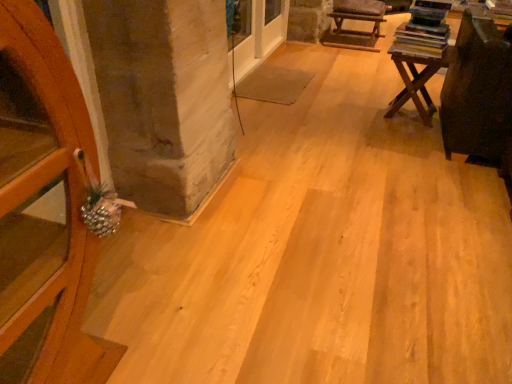
Find the location of `wooden table at right`. wooden table at right is located at coordinates (417, 75).

What is the approximate height of wooden table at right?

wooden table at right is 43.69 centimeters in height.

What do you see at coordinates (417, 75) in the screenshot? I see `wooden table at right` at bounding box center [417, 75].

This screenshot has width=512, height=384. Describe the element at coordinates (355, 19) in the screenshot. I see `brown leather armchair at upper right` at that location.

Measure the distance between brown leather armchair at upper right and camera.

brown leather armchair at upper right is 14.09 feet away from camera.

In order to face brown leather armchair at upper right, should I rotate leftwards or rightwards?

To face it directly, rotate right by 13.568 degrees.

In order to click on brown leather armchair at upper right in this screenshot , I will do `click(355, 19)`.

Find the location of `wooden table at right`. wooden table at right is located at coordinates (417, 75).

Is wooden table at right to the left of brown leather armchair at upper right from the viewer's perspective?

In fact, wooden table at right is to the right of brown leather armchair at upper right.

Which object is closer to the camera taking this photo, wooden table at right or brown leather armchair at upper right?

wooden table at right is in front.

Consider the image. Which point is more distant from viewer, (416,31) or (340,0)?

Point (340,0)

From the image's perspective, which object appears higher, wooden table at right or brown leather armchair at upper right?

brown leather armchair at upper right is shown above in the image.

In the scene shown: From a real-world perspective, is wooden table at right below brown leather armchair at upper right?

Actually, wooden table at right is physically above brown leather armchair at upper right in the real world.

Between wooden table at right and brown leather armchair at upper right, which one has larger width?

Wider between the two is brown leather armchair at upper right.

Based on the photo, in terms of height, does wooden table at right look taller or shorter compared to brown leather armchair at upper right?

wooden table at right is taller than brown leather armchair at upper right.

Who is bigger, wooden table at right or brown leather armchair at upper right?

With larger size is brown leather armchair at upper right.

Is brown leather armchair at upper right completely or partially inside wooden table at right?

No.

Would you say wooden table at right is a long distance from brown leather armchair at upper right?

Yes.

Is wooden table at right facing towards brown leather armchair at upper right?

Yes, wooden table at right is facing brown leather armchair at upper right.

How many degrees apart are the facing directions of wooden table at right and brown leather armchair at upper right?

wooden table at right and brown leather armchair at upper right are facing 86.1 degrees away from each other.

The image size is (512, 384). I want to click on table that appears below the brown leather armchair at upper right (from the image's perspective), so click(x=417, y=75).

Between brown leather armchair at upper right and wooden table at right, which one appears on the right side from the viewer's perspective?

From the viewer's perspective, wooden table at right appears more on the right side.

Is the depth of brown leather armchair at upper right less than that of wooden table at right?

No, brown leather armchair at upper right is further to the viewer.

Which point is more forward, [342,30] or [428,48]?

The point [428,48] is closer.

From the image's perspective, which one is positioned lower, brown leather armchair at upper right or wooden table at right?

wooden table at right, from the image's perspective.

From a real-world perspective, which is physically below, brown leather armchair at upper right or wooden table at right?

brown leather armchair at upper right.

Between brown leather armchair at upper right and wooden table at right, which one has larger width?

brown leather armchair at upper right is wider.

Based on the photo, is brown leather armchair at upper right taller than wooden table at right?

Incorrect, the height of brown leather armchair at upper right is not larger of that of wooden table at right.

Considering the sizes of objects brown leather armchair at upper right and wooden table at right in the image provided, who is bigger, brown leather armchair at upper right or wooden table at right?

With larger size is brown leather armchair at upper right.

Can we say brown leather armchair at upper right lies outside wooden table at right?

Absolutely, brown leather armchair at upper right is external to wooden table at right.

Is brown leather armchair at upper right beside wooden table at right?

No, brown leather armchair at upper right is not with wooden table at right.

Is brown leather armchair at upper right looking in the opposite direction of wooden table at right?

No, wooden table at right is not at the back of brown leather armchair at upper right.

Can you tell me how much brown leather armchair at upper right and wooden table at right differ in facing direction?

The angle between the facing direction of brown leather armchair at upper right and the facing direction of wooden table at right is 86.1 degrees.

How much distance is there between brown leather armchair at upper right and wooden table at right?

brown leather armchair at upper right is 1.77 meters away from wooden table at right.

The width and height of the screenshot is (512, 384). What are the coordinates of `table that is in front of the brown leather armchair at upper right` in the screenshot? It's located at (417, 75).

Locate an element on the screen. The width and height of the screenshot is (512, 384). armchair behind the wooden table at right is located at coordinates (355, 19).

The image size is (512, 384). I want to click on table located in front of the brown leather armchair at upper right, so click(x=417, y=75).